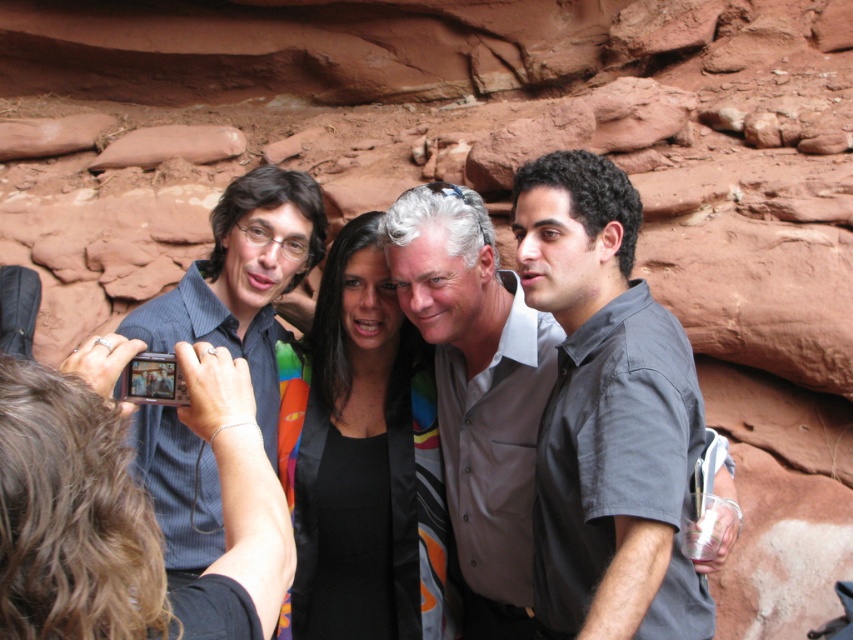
Question: Among these objects, which one is nearest to the camera?

Choices:
 (A) gray matte shirt at center
 (B) blue striped shirt at left

Answer: (B)

Question: Which point is closer to the camera?

Choices:
 (A) gray matte shirt at center
 (B) blue striped shirt at left

Answer: (B)

Question: Does gray matte shirt at center have a larger size compared to blue striped shirt at left?

Choices:
 (A) yes
 (B) no

Answer: (A)

Question: Can you confirm if gray matte shirt at center is smaller than blue striped shirt at left?

Choices:
 (A) yes
 (B) no

Answer: (B)

Question: In this image, where is gray matte shirt at center located relative to blue striped shirt at left?

Choices:
 (A) below
 (B) above

Answer: (A)